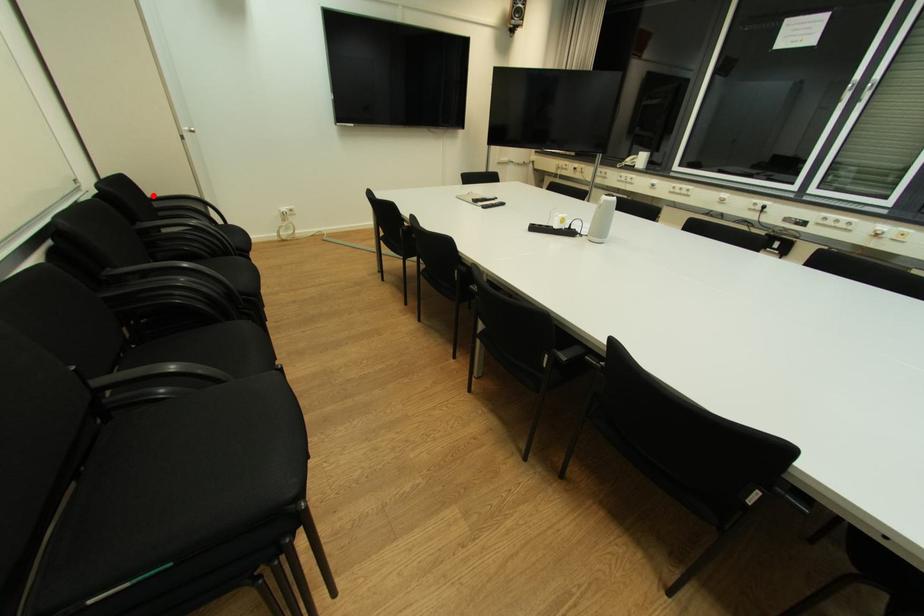
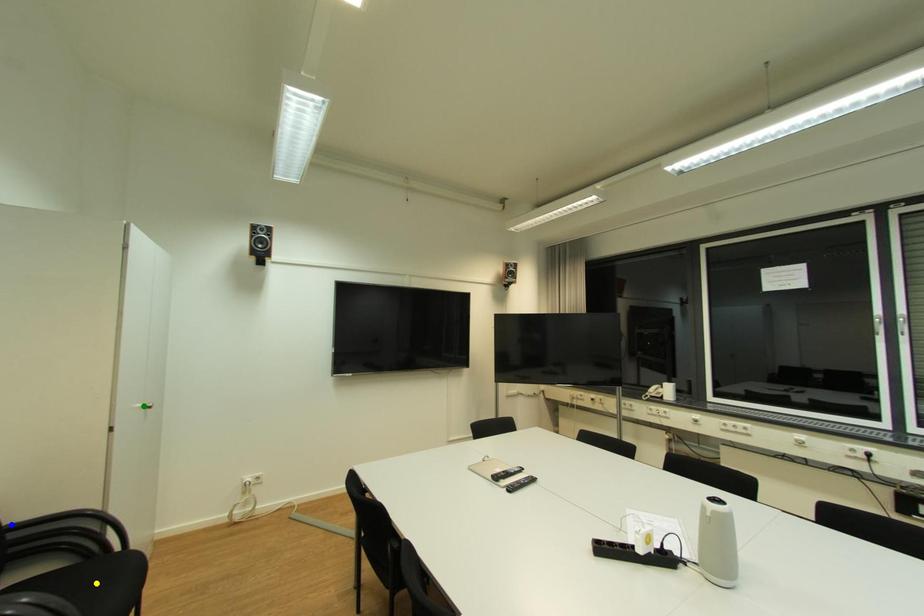
Question: I am providing you with two images of the same scene from different viewpoints. A red point is marked on the first image. You are given multiple points on the second image. Which spot in image 2 lines up with the point in image 1?

Choices:
 (A) blue point
 (B) green point
 (C) yellow point

Answer: (A)